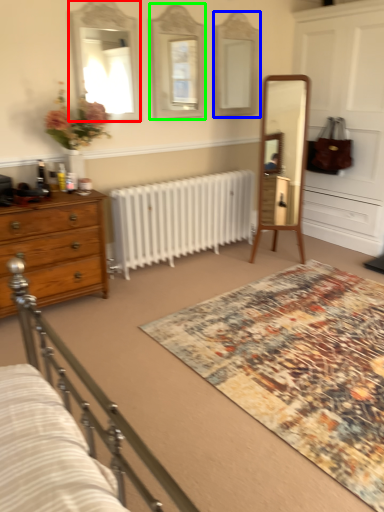
Question: Which object is the closest to the mirror (highlighted by a red box)? Choose among these: mirror (highlighted by a blue box) or mirror (highlighted by a green box).

Choices:
 (A) mirror
 (B) mirror

Answer: (B)